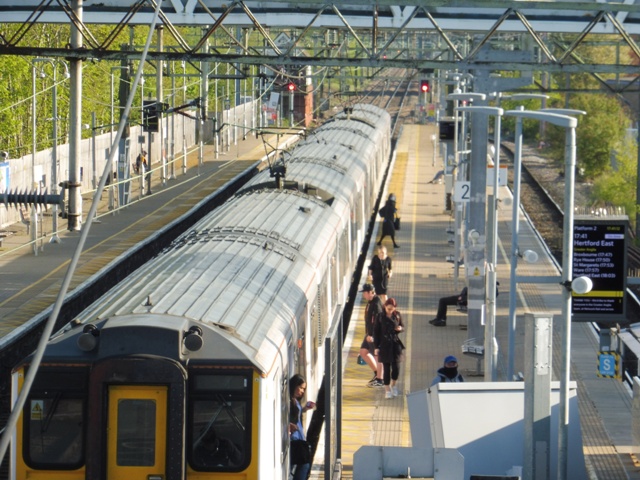
Locate an element on the screen. cable is located at coordinates (40, 345).